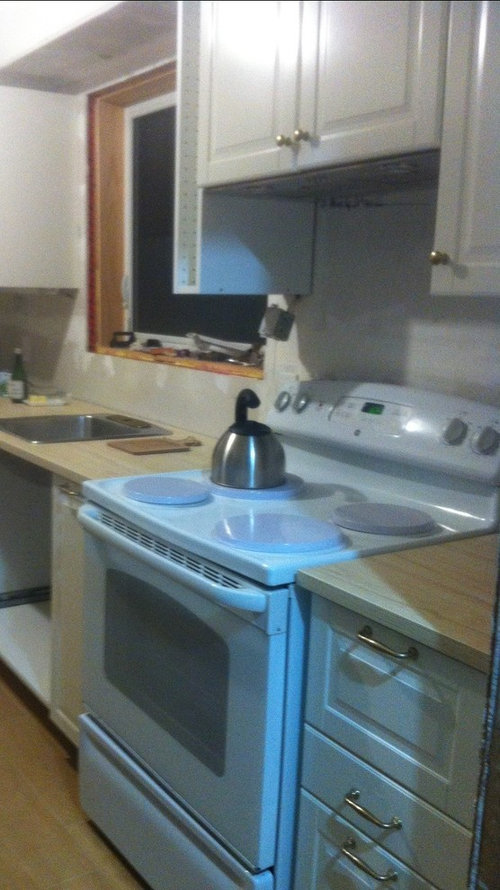
At what (x,y) coordinates should I click in order to perform the action: click on controls for setting burners' temperature. Please return your answer as a coordinate pair (x, y). Looking at the image, I should click on (280, 399), (300, 400), (453, 429), (486, 435).